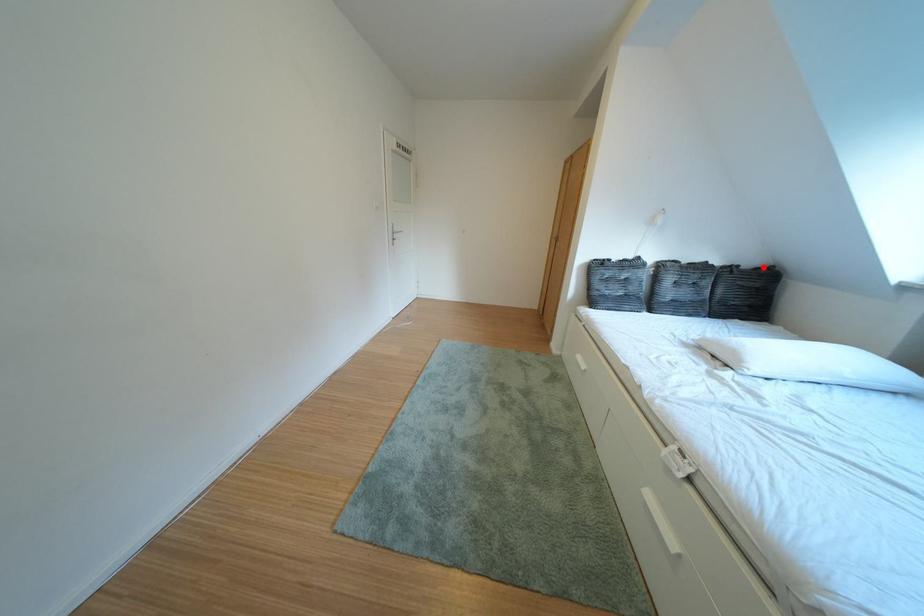
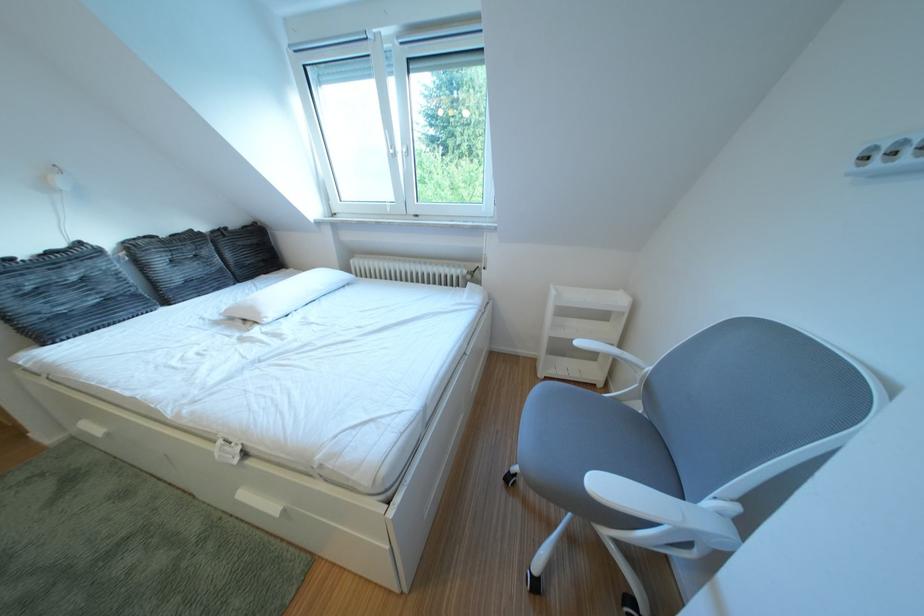
Where in the second image is the point corresponding to the highlighted location from the first image?

(247, 228)